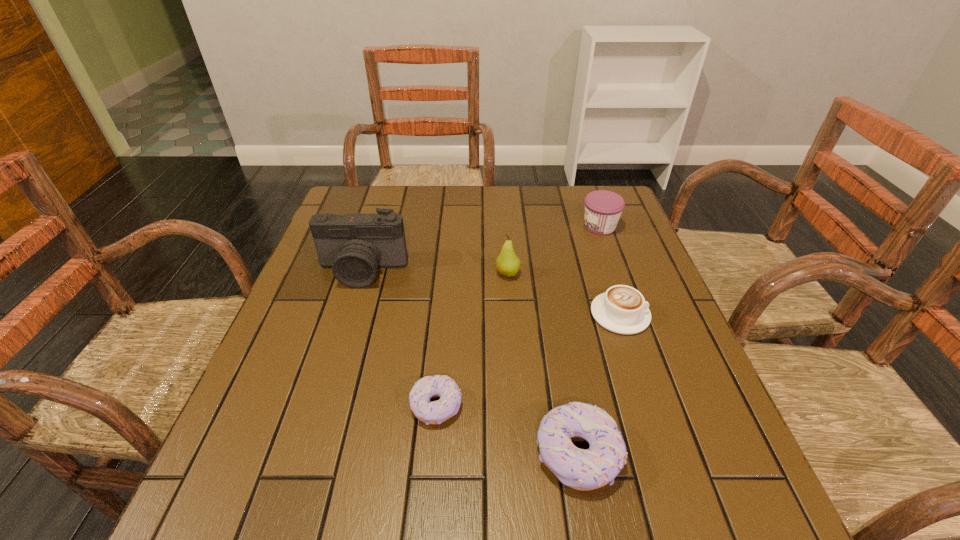
At what (x,y) coordinates should I click in order to perform the action: click on empty location between the taller doughnut and the left doughnut. Please return your answer as a coordinate pair (x, y). Image resolution: width=960 pixels, height=540 pixels. Looking at the image, I should click on 507,430.

Identify the location of free space between the leftmost object and the farthest object. Image resolution: width=960 pixels, height=540 pixels. (481, 248).

This screenshot has height=540, width=960. What are the coordinates of `unoccupied position between the tallest object and the shortest object` in the screenshot? It's located at (399, 339).

This screenshot has width=960, height=540. I want to click on free point between the tallest object and the shorter doughnut, so click(399, 339).

Locate an element on the screen. The height and width of the screenshot is (540, 960). vacant point located between the taller doughnut and the shorter doughnut is located at coordinates (507, 430).

At what (x,y) coordinates should I click in order to perform the action: click on free space between the fourth farthest object and the taller doughnut. Please return your answer as a coordinate pair (x, y). The height and width of the screenshot is (540, 960). Looking at the image, I should click on (599, 384).

Identify the location of free area in between the taller doughnut and the fifth object from right to left. The image size is (960, 540). (507, 430).

I want to click on unoccupied position between the jam and the right doughnut, so click(588, 340).

Identify which object is the closest to the taller doughnut. Please provide its 2D coordinates. Your answer should be formatted as a tuple, i.e. [(x, y)], where the tuple contains the x and y coordinates of a point satisfying the conditions above.

[(436, 412)]

Identify which object is the third nearest to the taller doughnut. Please provide its 2D coordinates. Your answer should be formatted as a tuple, i.e. [(x, y)], where the tuple contains the x and y coordinates of a point satisfying the conditions above.

[(507, 263)]